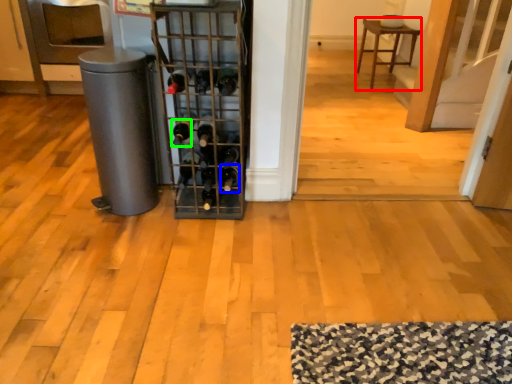
Question: Which object is the closest to the furniture (highlighted by a red box)? Choose among these: wine bottle (highlighted by a blue box) or wine bottle (highlighted by a green box).

Choices:
 (A) wine bottle
 (B) wine bottle

Answer: (A)